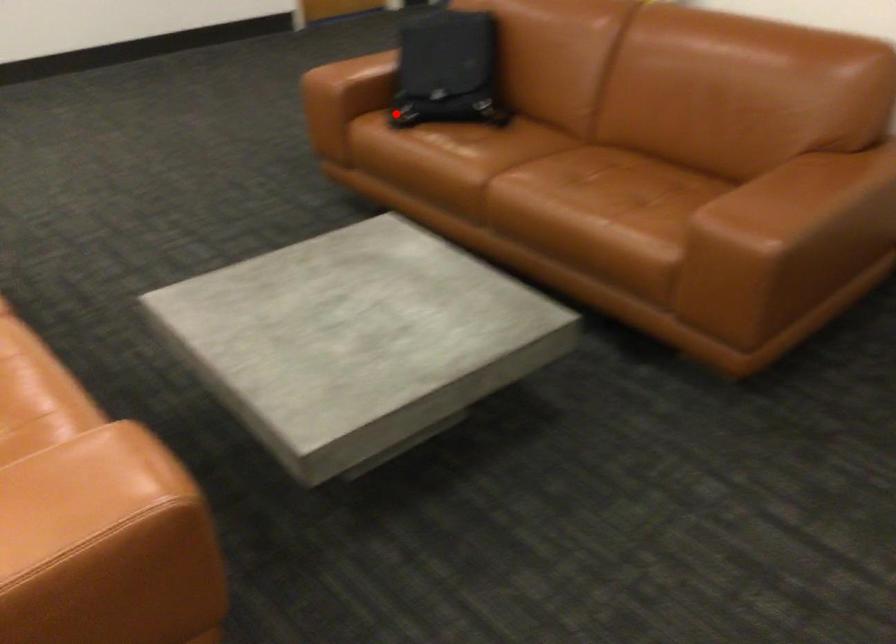
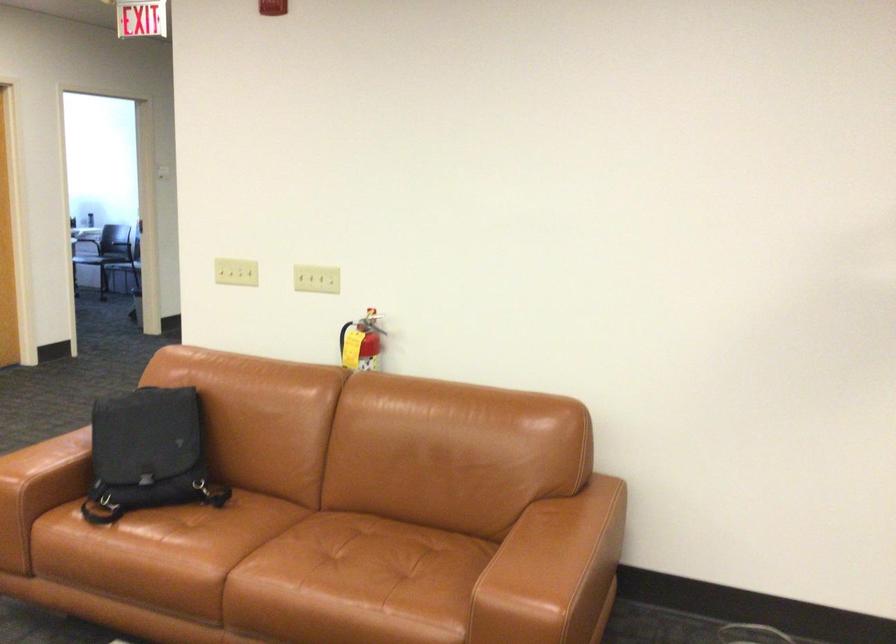
Question: A red point is marked in image1. In image2, is the corresponding 3D point closer to the camera or farther? Reply with the corresponding letter.

Choices:
 (A) The corresponding 3D point is closer.
 (B) The corresponding 3D point is farther.

Answer: (A)